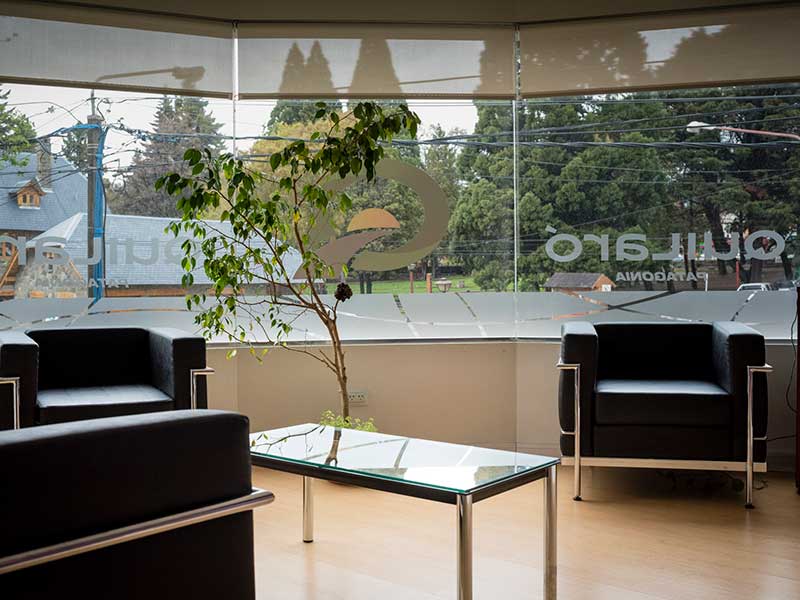
You are a GUI agent. You are given a task and a screenshot of the screen. Output one action in this format:
    pyautogui.click(x=<x>, y=<y>)
    Task: Click on the blinds
    Image resolution: width=800 pixels, height=600 pixels.
    Given the screenshot: What is the action you would take?
    pyautogui.click(x=186, y=76), pyautogui.click(x=345, y=78), pyautogui.click(x=578, y=80)